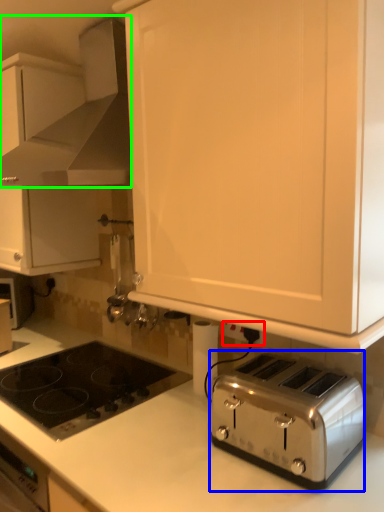
Question: Considering the real-world distances, which object is closest to electric outlet (highlighted by a red box)? toaster (highlighted by a blue box) or home appliance (highlighted by a green box).

Choices:
 (A) toaster
 (B) home appliance

Answer: (A)